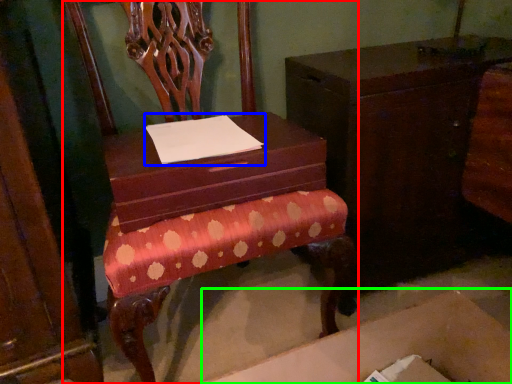
Question: Based on their relative distances, which object is nearer to chair (highlighted by a red box)? Choose from notepad (highlighted by a blue box) and cardboard box (highlighted by a green box).

Choices:
 (A) notepad
 (B) cardboard box

Answer: (A)